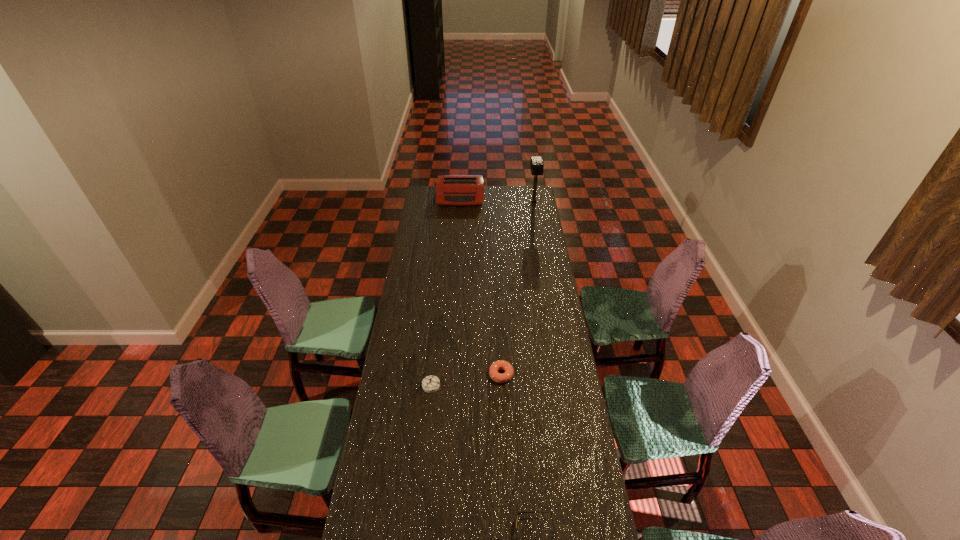
I want to click on the tallest object, so click(x=536, y=164).

Image resolution: width=960 pixels, height=540 pixels. I want to click on the rightmost object, so click(x=536, y=164).

Where is `typewriter`? Image resolution: width=960 pixels, height=540 pixels. typewriter is located at coordinates (457, 190).

Locate an element on the screen. This screenshot has height=540, width=960. the third shortest object is located at coordinates (430, 384).

The height and width of the screenshot is (540, 960). I want to click on doughnut, so click(498, 377).

Where is `free location located on the front of the rightmost object`? The width and height of the screenshot is (960, 540). free location located on the front of the rightmost object is located at coordinates (540, 240).

You are a GUI agent. You are given a task and a screenshot of the screen. Output one action in this format:
    pyautogui.click(x=<x>, y=<y>)
    Task: Click on the vacant space located 0.320m on the typing side of the fourth shortest object
    This screenshot has height=540, width=960.
    Given the screenshot: What is the action you would take?
    pyautogui.click(x=458, y=237)

Where is `free space located 0.100m on the back of the compass`? free space located 0.100m on the back of the compass is located at coordinates (433, 357).

Find the location of a particular element. This screenshot has height=540, width=960. free spot located on the front of the fourth tallest object is located at coordinates (503, 418).

Identify the location of mallet that is at the far edge. (536, 164).